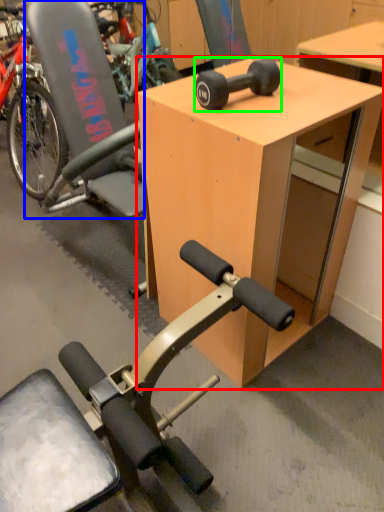
Question: Estimate the real-world distances between objects in this image. Which object is farther from desk (highlighted by a red box), swivel chair (highlighted by a blue box) or wheel (highlighted by a green box)?

Choices:
 (A) swivel chair
 (B) wheel

Answer: (A)